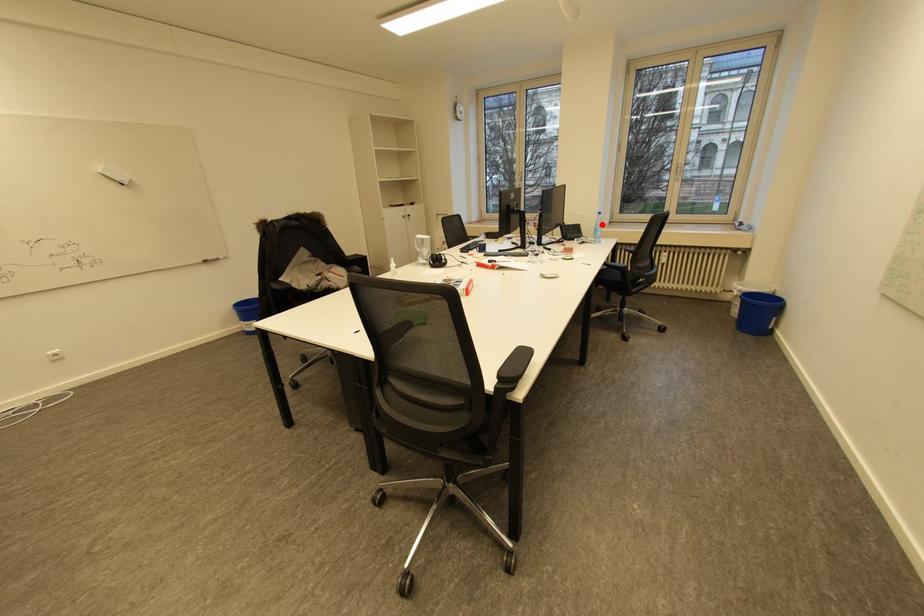
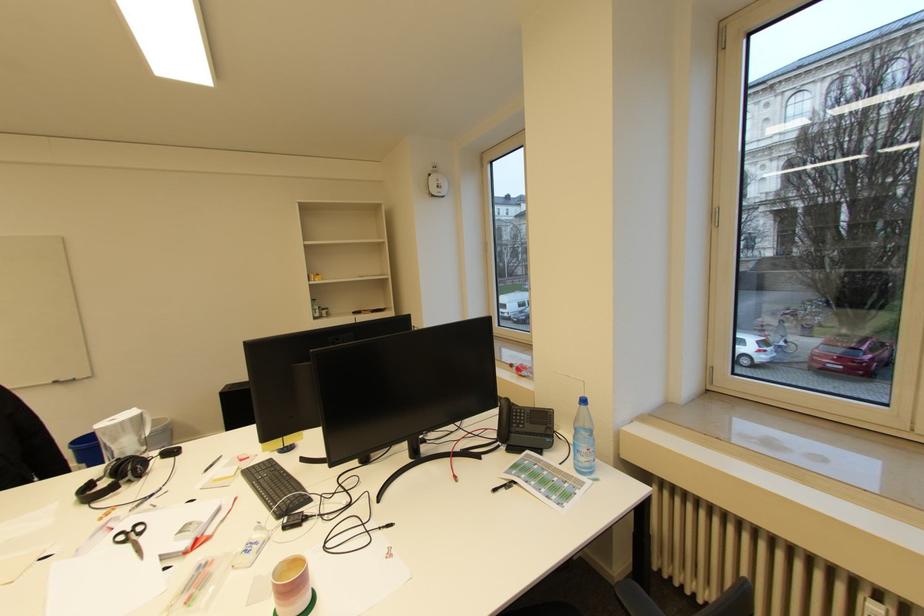
Question: I am providing you with two images of the same scene from different viewpoints. In image1, a red point is highlighted. Considering the same 3D point in image2, which of the following is correct?

Choices:
 (A) It is closer
 (B) It is farther

Answer: (B)